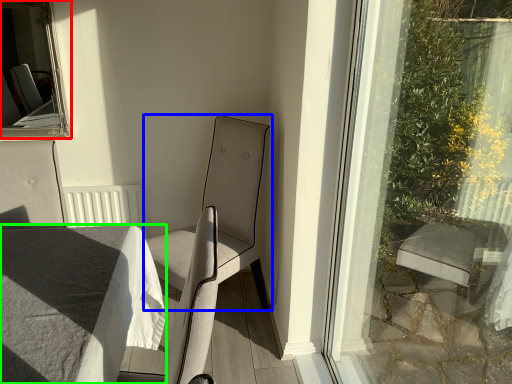
Question: Which is nearer to the bay window (highlighted by a red box)? chair (highlighted by a blue box) or table (highlighted by a green box).

Choices:
 (A) chair
 (B) table

Answer: (A)